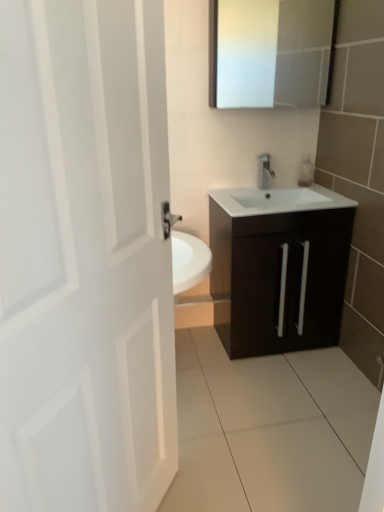
Find the location of a particular element. Image resolution: width=384 pixels, height=512 pixels. vacant area that is in front of satin nickel faucet at center is located at coordinates (271, 197).